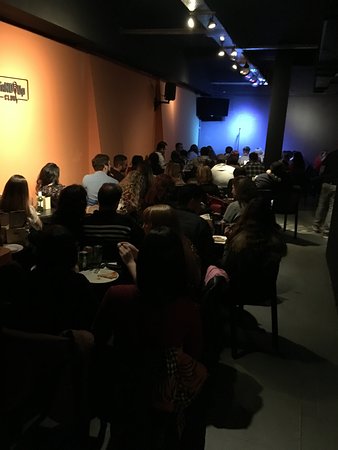
Image resolution: width=338 pixels, height=450 pixels. I want to click on lights, so click(x=193, y=22), click(x=196, y=5), click(x=209, y=22), click(x=224, y=37), click(x=225, y=51), click(x=244, y=129), click(x=235, y=64), click(x=237, y=53), click(x=261, y=83), click(x=253, y=75).